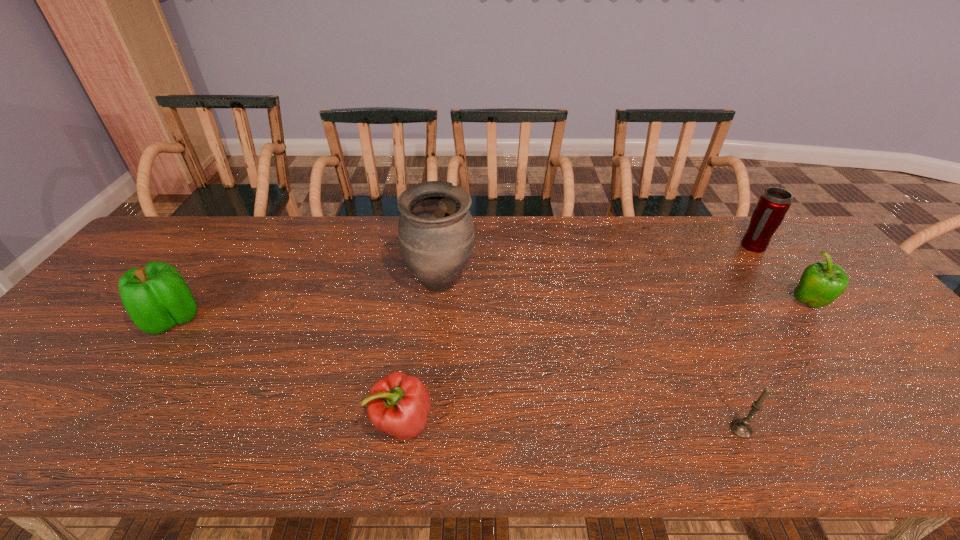
The image size is (960, 540). What are the coordinates of `vacant region between the candle and the second bell pepper from left to right` in the screenshot? It's located at (572, 426).

Identify the location of free space between the leftmost bell pepper and the third object from right to left. (457, 374).

This screenshot has width=960, height=540. I want to click on empty location between the shortest bell pepper and the leftmost bell pepper, so click(287, 371).

In order to click on the fourth closest object to the leftmost bell pepper in this screenshot , I will do `click(774, 203)`.

Locate an element on the screen. the third closest object to the leftmost bell pepper is located at coordinates (742, 428).

Choose which bell pepper is the nearest neighbor to the nearest bell pepper. Please provide its 2D coordinates. Your answer should be formatted as a tuple, i.e. [(x, y)], where the tuple contains the x and y coordinates of a point satisfying the conditions above.

[(156, 297)]

Identify which bell pepper is the nearest to the second bell pepper from right to left. Please provide its 2D coordinates. Your answer should be formatted as a tuple, i.e. [(x, y)], where the tuple contains the x and y coordinates of a point satisfying the conditions above.

[(156, 297)]

In order to click on vacant space that satisfies the following two spatial constraints: 1. on the back side of the third object from right to left; 2. on the right side of the rightmost bell pepper in this screenshot , I will do pyautogui.click(x=680, y=303).

Find the location of a particular element. free spot that satisfies the following two spatial constraints: 1. on the front side of the candle; 2. on the right side of the tallest object is located at coordinates (425, 429).